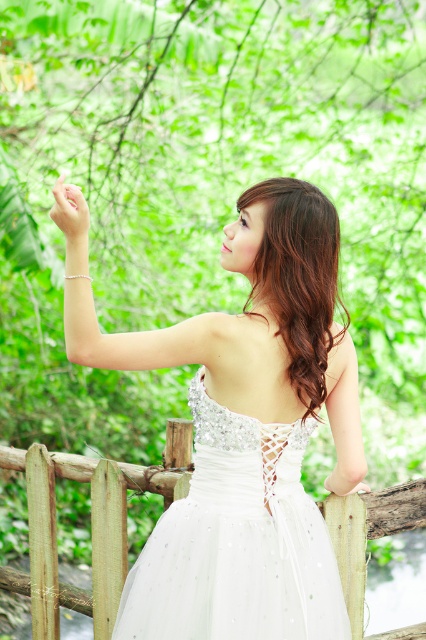
Question: Estimate the real-world distances between objects in this image. Which object is farther from the wooden fence at center?

Choices:
 (A) pale skin at upper left
 (B) white tulle dress at center

Answer: (A)

Question: Is white satin dress at center wider than pale skin at upper left?

Choices:
 (A) no
 (B) yes

Answer: (B)

Question: Which object is closer to the camera taking this photo?

Choices:
 (A) white satin dress at center
 (B) wooden fence at center

Answer: (A)

Question: Can you confirm if white tulle dress at center is smaller than wooden fence at center?

Choices:
 (A) yes
 (B) no

Answer: (A)

Question: Which point is closer to the camera?

Choices:
 (A) (331, 564)
 (B) (54, 184)

Answer: (A)

Question: Observing the image, what is the correct spatial positioning of white tulle dress at center in reference to wooden fence at center?

Choices:
 (A) right
 (B) left

Answer: (A)